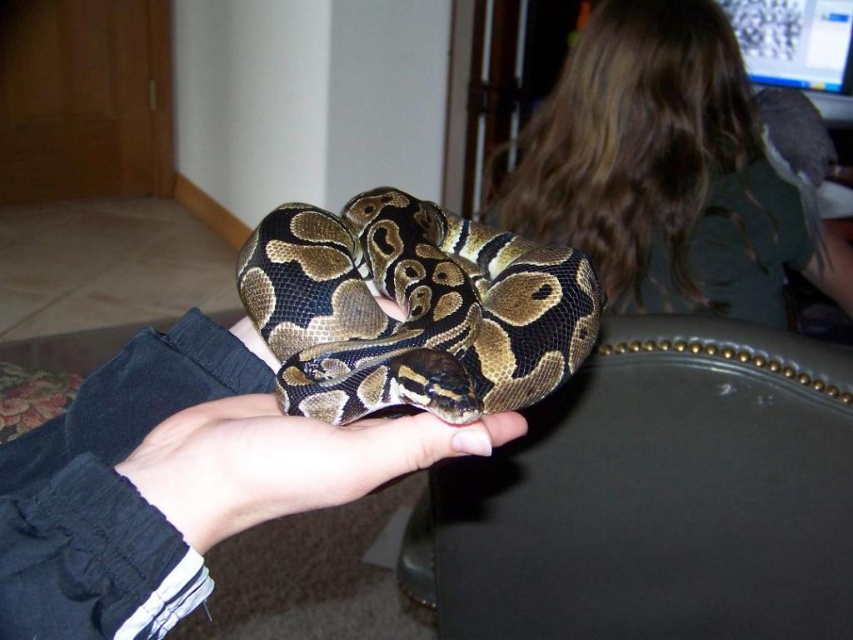
How distant is smooth brown snake at center from dark brown hair at upper right?

smooth brown snake at center and dark brown hair at upper right are 1.21 meters apart from each other.

In the scene shown: Does smooth brown snake at center have a lesser height compared to dark brown hair at upper right?

Yes.

Is point (148, 362) closer to viewer compared to point (637, 164)?

Yes, point (148, 362) is closer to viewer.

Identify the location of smooth brown snake at center. (177, 481).

Between point (682, 268) and point (340, 241), which one is positioned behind?

The point (682, 268) is more distant.

Is dark brown hair at upper right positioned behind camouflage-patterned snake at center?

Yes, it is.

Find the location of a particular element. dark brown hair at upper right is located at coordinates (665, 172).

Where is `dark brown hair at upper right`? This screenshot has width=853, height=640. dark brown hair at upper right is located at coordinates (665, 172).

From the picture: Is smooth brown snake at center bigger than camouflage-patterned snake at center?

Yes, smooth brown snake at center is bigger than camouflage-patterned snake at center.

Is smooth brown snake at center thinner than camouflage-patterned snake at center?

In fact, smooth brown snake at center might be wider than camouflage-patterned snake at center.

Image resolution: width=853 pixels, height=640 pixels. What are the coordinates of `smooth brown snake at center` in the screenshot? It's located at (177, 481).